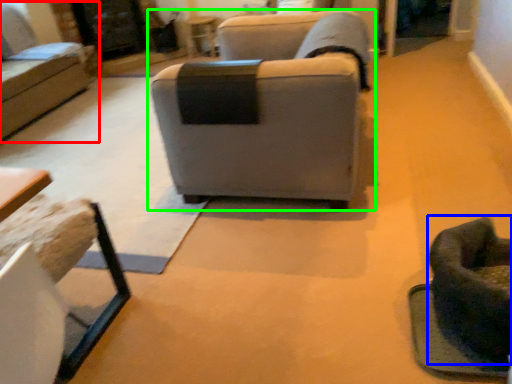
Question: Which object is positioned closest to studio couch (highlighted by a red box)? Select from swivel chair (highlighted by a blue box) and studio couch (highlighted by a green box).

Choices:
 (A) swivel chair
 (B) studio couch

Answer: (B)